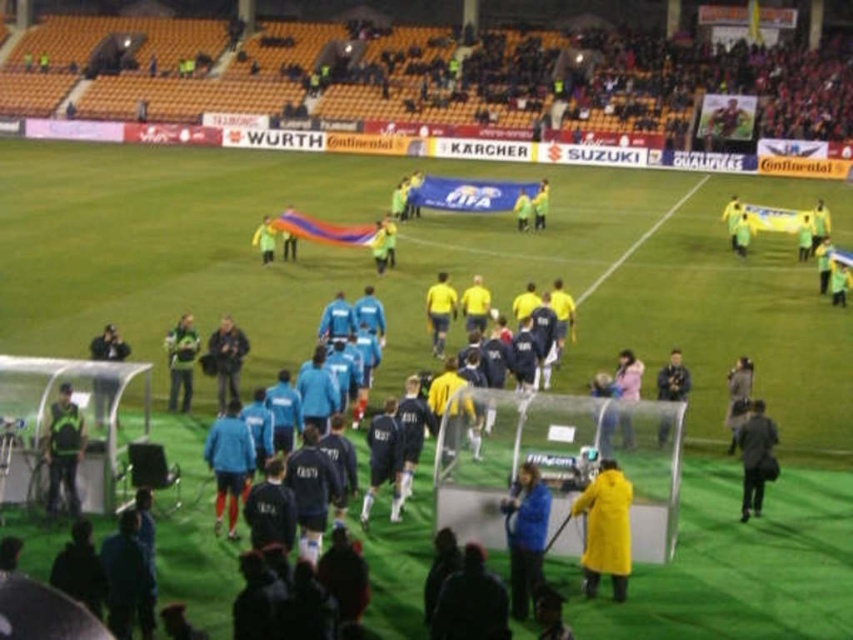
You are a photographer positioned at the edge of the football field. You need to capture a photo of both the blue matte jacket at center and the yellow matte shirt at center. Which of the two objects should you zoom in on to ensure they both fit in the frame without cropping?

The blue matte jacket at center has a lesser width compared to the yellow matte shirt at center, so you should zoom in on the wider yellow matte shirt at center to ensure both fit in the frame.

You are a photographer at the stadium and want to take a photo of both the blue fabric jacket at center and the black matte jacket at lower right. Which jacket will appear closer to the camera in the photo?

The blue fabric jacket at center will appear closer to the camera because it is in front of the black matte jacket at lower right.

You are a photographer positioned at the bottom left corner of the stadium field. You want to take a photo of the blue matte jacket at center. Which direction should you aim your camera to capture it?

The blue matte jacket at center is located at coordinates 0.838 on the x axis and 0.617 on the y axis. Since you are at the bottom left corner, aiming your camera towards the upper right direction will capture the blue matte jacket at center.